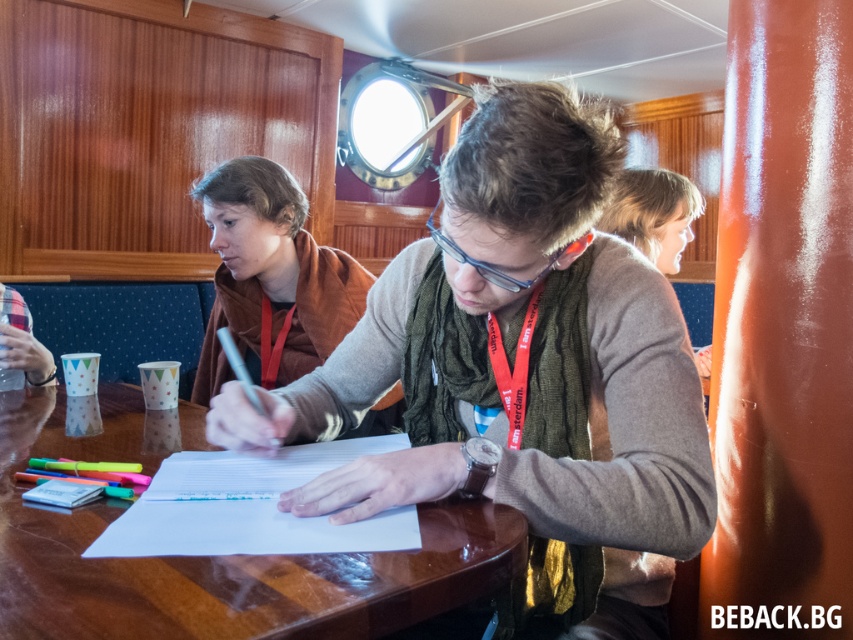
Does green sweater at center lie behind brown leather jacket at upper left?

No, green sweater at center is closer to the viewer.

Does green sweater at center appear under brown leather jacket at upper left?

Yes, green sweater at center is below brown leather jacket at upper left.

At what (x,y) coordinates should I click in order to perform the action: click on green sweater at center. Please return your answer as a coordinate pair (x, y). The width and height of the screenshot is (853, 640). Looking at the image, I should click on (520, 362).

Does green sweater at center have a lesser height compared to wooden table at center?

No.

Is point (538, 260) more distant than point (74, 540)?

That is True.

Identify the location of green sweater at center. Image resolution: width=853 pixels, height=640 pixels. (520, 362).

Is wooden table at center further to the viewer compared to brown leather jacket at upper left?

No, wooden table at center is closer to the viewer.

Who is shorter, wooden table at center or brown leather jacket at upper left?

wooden table at center is shorter.

Identify the location of wooden table at center. This screenshot has width=853, height=640. (213, 556).